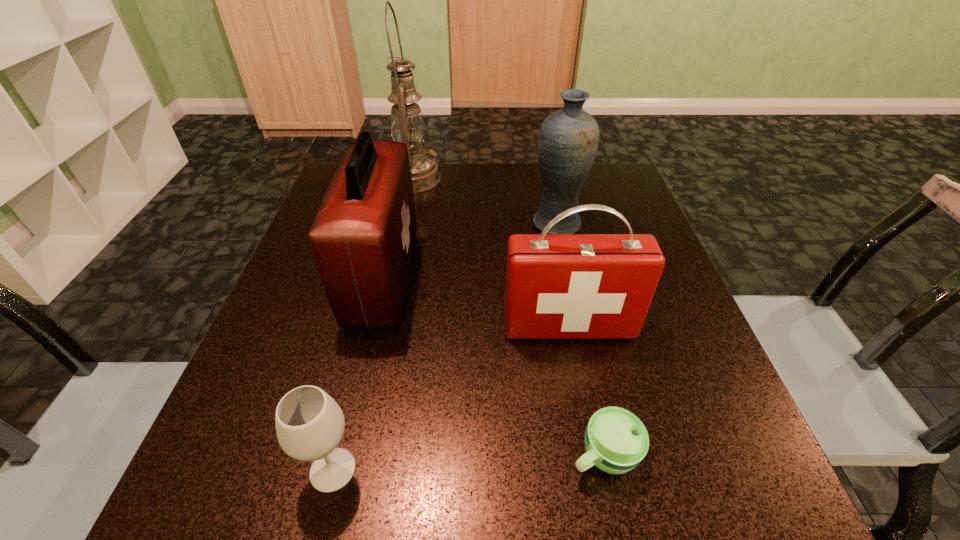
At what (x,y) coordinates should I click in order to perform the action: click on vacant space at the far right corner. Please return your answer as a coordinate pair (x, y). This screenshot has height=540, width=960. Looking at the image, I should click on (595, 213).

Image resolution: width=960 pixels, height=540 pixels. I want to click on free space between the right first-aid kit and the shortest object, so click(x=587, y=391).

Identify the location of empty space between the farthest object and the vase. The image size is (960, 540). (485, 201).

Locate an element on the screen. This screenshot has width=960, height=540. vacant space in between the vase and the shortest object is located at coordinates (580, 340).

Identify the location of empty location between the cup and the right first-aid kit. The width and height of the screenshot is (960, 540). (587, 391).

I want to click on vacant space in between the right first-aid kit and the left first-aid kit, so click(476, 302).

Where is `object identified as the fourth closest to the left first-aid kit`? object identified as the fourth closest to the left first-aid kit is located at coordinates (568, 139).

What are the coordinates of `the second closest object to the farthest object` in the screenshot? It's located at (568, 139).

What are the coordinates of `blank space that satisfies the following two spatial constraints: 1. on the front face of the right first-aid kit; 2. on the left side of the cup` in the screenshot? It's located at (593, 455).

The width and height of the screenshot is (960, 540). Identify the location of vacant area that satisfies the following two spatial constraints: 1. on the front side of the oil lamp; 2. on the left side of the vase. (403, 225).